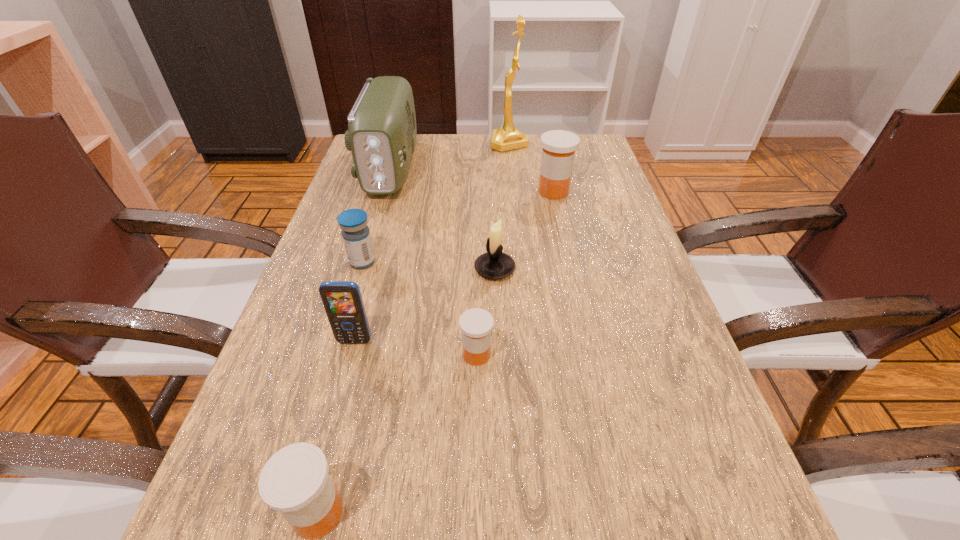
Identify the location of blank space located on the front-facing side of the golden award. The image size is (960, 540). (381, 143).

This screenshot has width=960, height=540. What are the coordinates of `vacant point located 0.320m on the front-facing side of the golden award` in the screenshot? It's located at (388, 143).

Locate an element on the screen. The width and height of the screenshot is (960, 540). free space located 0.380m on the front-facing side of the golden award is located at coordinates [x=369, y=143].

Identify the location of free spot located on the front-facing side of the radio_receiver. The width and height of the screenshot is (960, 540). (361, 267).

This screenshot has width=960, height=540. I want to click on free space located on the label of the biggest orange medicine, so click(x=468, y=192).

Find the location of a particular element. vacant area located on the label of the biggest orange medicine is located at coordinates (426, 192).

Locate an element on the screen. free space located on the label of the biggest orange medicine is located at coordinates (502, 192).

Locate an element on the screen. The width and height of the screenshot is (960, 540). free space located 0.060m on the screen of the cellular telephone is located at coordinates (346, 374).

The image size is (960, 540). What are the coordinates of `free space located 0.160m on the front of the white candle holder` in the screenshot? It's located at (497, 345).

Where is `vacant space located 0.160m on the right of the second farthest medicine`? This screenshot has height=540, width=960. vacant space located 0.160m on the right of the second farthest medicine is located at coordinates (449, 262).